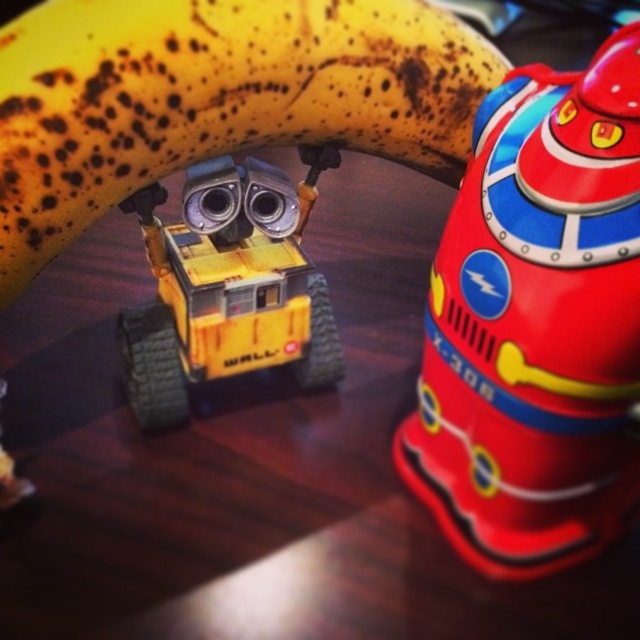
Who is lower down, yellow spotted banana at upper center or yellow matte robot at center?

yellow matte robot at center is below.

Which is behind, point (52, 180) or point (230, 362)?

Positioned behind is point (230, 362).

Image resolution: width=640 pixels, height=640 pixels. In order to click on yellow spotted banana at upper center in this screenshot , I will do `click(216, 99)`.

Is shiny plastic toy at upper right closer to camera compared to yellow spotted banana at upper center?

Yes, it is in front of yellow spotted banana at upper center.

Which is above, shiny plastic toy at upper right or yellow spotted banana at upper center?

yellow spotted banana at upper center is above.

Between point (611, 323) and point (216, 67), which one is positioned behind?

Positioned behind is point (216, 67).

Where is `shiny plastic toy at upper right`? This screenshot has height=640, width=640. shiny plastic toy at upper right is located at coordinates (536, 324).

Who is more distant from viewer, (403,461) or (193,284)?

Positioned behind is point (403,461).

Is point (452, 522) farther from viewer compared to point (148, 397)?

No, it is in front of (148, 397).

Between point (502, 572) and point (253, 308), which one is positioned in front?

Point (502, 572) is more forward.

Locate an element on the screen. The width and height of the screenshot is (640, 640). shiny plastic toy at upper right is located at coordinates (536, 324).